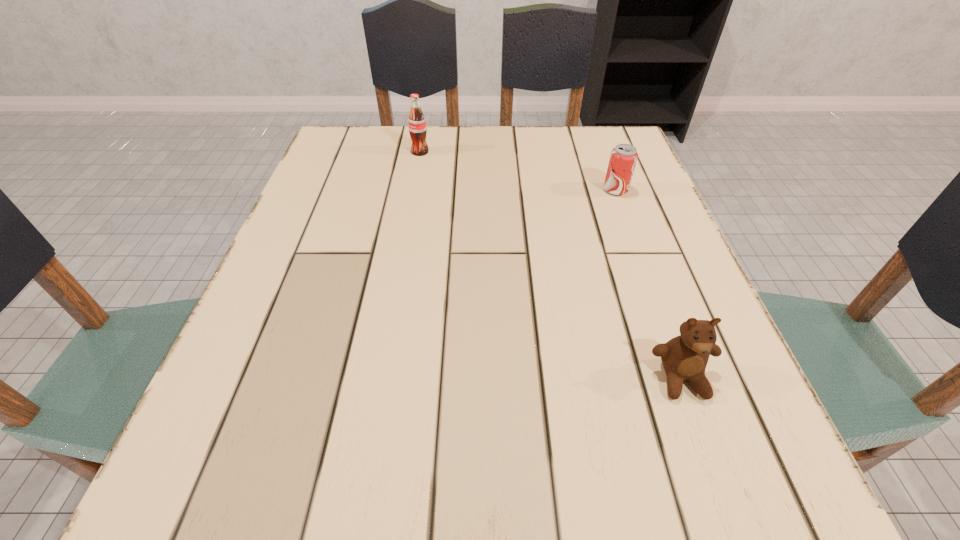
Find the location of a particular element. free space between the teddy bear and the second farthest object is located at coordinates (648, 284).

Find the location of `vacant space in between the nearest object and the farther soda can`. vacant space in between the nearest object and the farther soda can is located at coordinates (551, 265).

Find the location of a particular element. free space between the farthest object and the second nearest object is located at coordinates (517, 171).

Identify the location of empty space that is in between the farthest object and the nearer soda can. Image resolution: width=960 pixels, height=540 pixels. (517, 171).

This screenshot has height=540, width=960. I want to click on free space between the teddy bear and the leftmost object, so click(551, 265).

This screenshot has height=540, width=960. Identify the location of free area in between the teddy bear and the second farthest object. (648, 284).

I want to click on object that ranks as the second closest to the nearest object, so click(417, 125).

Identify the location of object that is the closest one to the nearest object. The width and height of the screenshot is (960, 540). (623, 158).